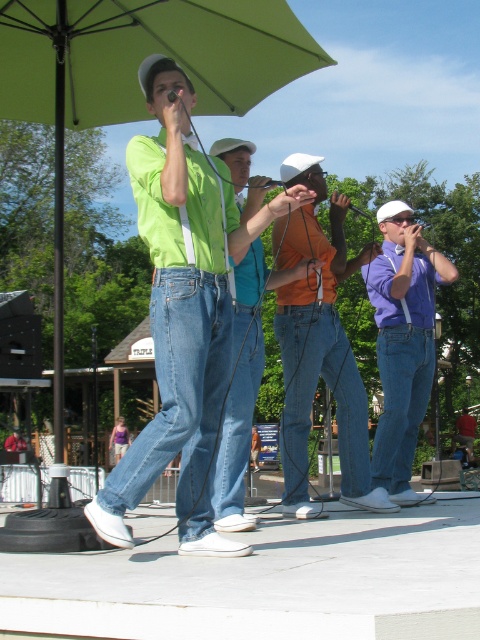
Can you confirm if matte green shirt at center is bigger than purple matte shirt at center?

Indeed, matte green shirt at center has a larger size compared to purple matte shirt at center.

Looking at this image, measure the distance between matte green shirt at center and purple matte shirt at center.

2.55 meters

Who is more distant from viewer, [210,452] or [370,284]?

The point [370,284] is behind.

This screenshot has height=640, width=480. I want to click on matte green shirt at center, so click(178, 320).

Between green fabric umbrella at upper center and purple matte shirt at center, which one appears on the left side from the viewer's perspective?

From the viewer's perspective, green fabric umbrella at upper center appears more on the left side.

What do you see at coordinates (134, 76) in the screenshot? I see `green fabric umbrella at upper center` at bounding box center [134, 76].

Image resolution: width=480 pixels, height=640 pixels. Identify the location of green fabric umbrella at upper center. (134, 76).

Between orange matte shirt at center and purple matte shirt at center, which one appears on the left side from the viewer's perspective?

From the viewer's perspective, orange matte shirt at center appears more on the left side.

Is orange matte shirt at center above purple matte shirt at center?

Actually, orange matte shirt at center is below purple matte shirt at center.

Between point (287, 264) and point (396, 250), which one is positioned behind?

Point (396, 250)

The image size is (480, 640). What are the coordinates of `orange matte shirt at center` in the screenshot? It's located at (319, 346).